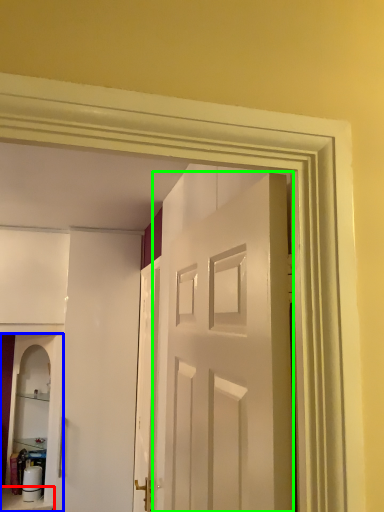
Question: Estimate the real-world distances between objects in this image. Which object is farther from furniture (highlighted by a red box), cabinetry (highlighted by a blue box) or door (highlighted by a green box)?

Choices:
 (A) cabinetry
 (B) door

Answer: (B)